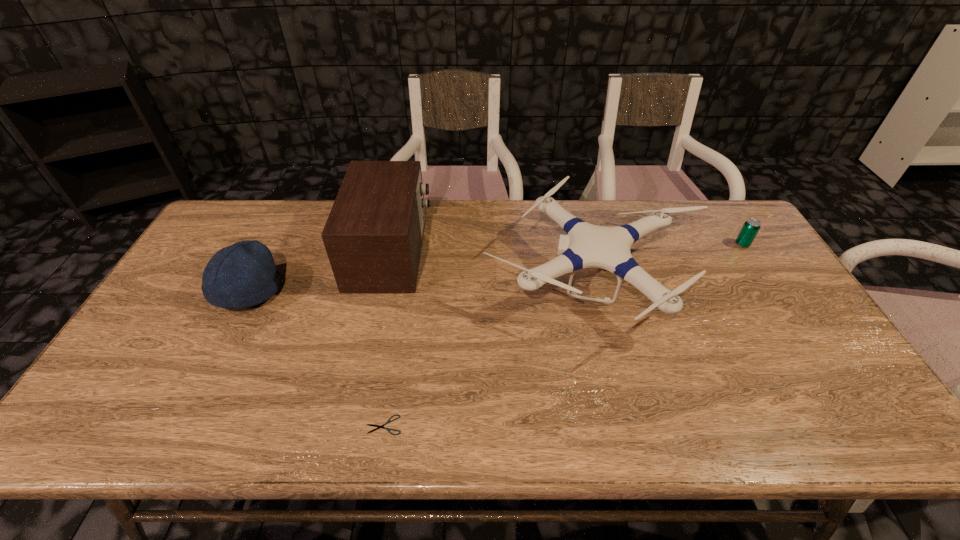
Identify the location of free location located 0.070m on the back of the skullcap. (269, 253).

Locate an element on the screen. The width and height of the screenshot is (960, 540). free space located 0.140m on the front of the second shortest object is located at coordinates (765, 280).

Locate an element on the screen. free space located 0.220m on the left of the shears is located at coordinates (268, 425).

What are the coordinates of `radio receiver at the far edge` in the screenshot? It's located at (373, 236).

You are a GUI agent. You are given a task and a screenshot of the screen. Output one action in this format:
    pyautogui.click(x=<x>, y=<y>)
    Task: Click on the drone that is positioned at the far edge
    
    Given the screenshot: What is the action you would take?
    [586, 245]

Where is `beer can that is at the far edge`? This screenshot has width=960, height=540. beer can that is at the far edge is located at coordinates (751, 227).

At what (x,y) coordinates should I click in order to perform the action: click on object present at the near edge. Please return your answer as a coordinate pair (x, y). This screenshot has width=960, height=540. Looking at the image, I should click on (378, 426).

Locate an element on the screen. This screenshot has width=960, height=540. object that is positioned at the left edge is located at coordinates (244, 274).

Find the location of a particular element. object situated at the right edge is located at coordinates (751, 227).

Image resolution: width=960 pixels, height=540 pixels. Identify the location of object that is positioned at the far right corner. (751, 227).